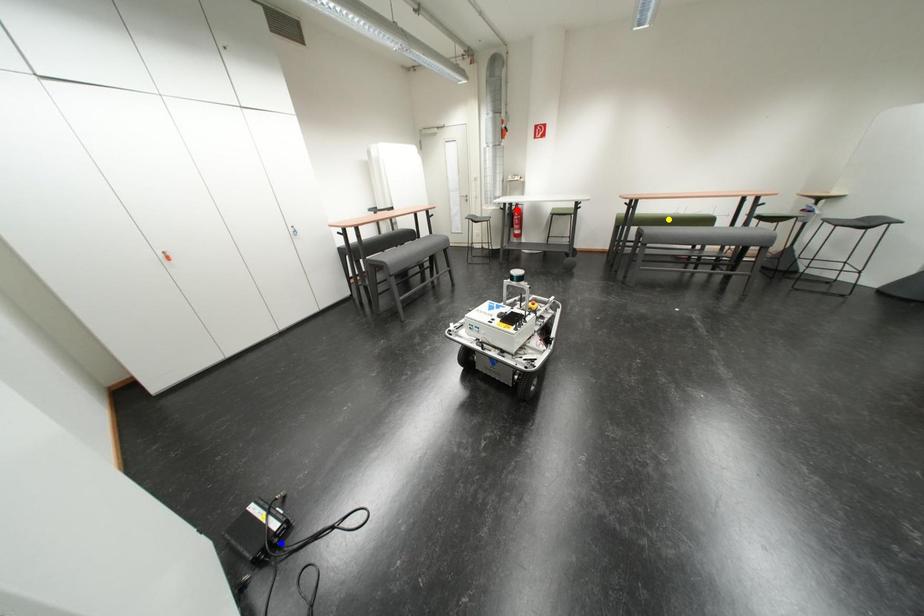
Order these from nearest to farthest:
blue point | red point | yellow point

blue point < yellow point < red point